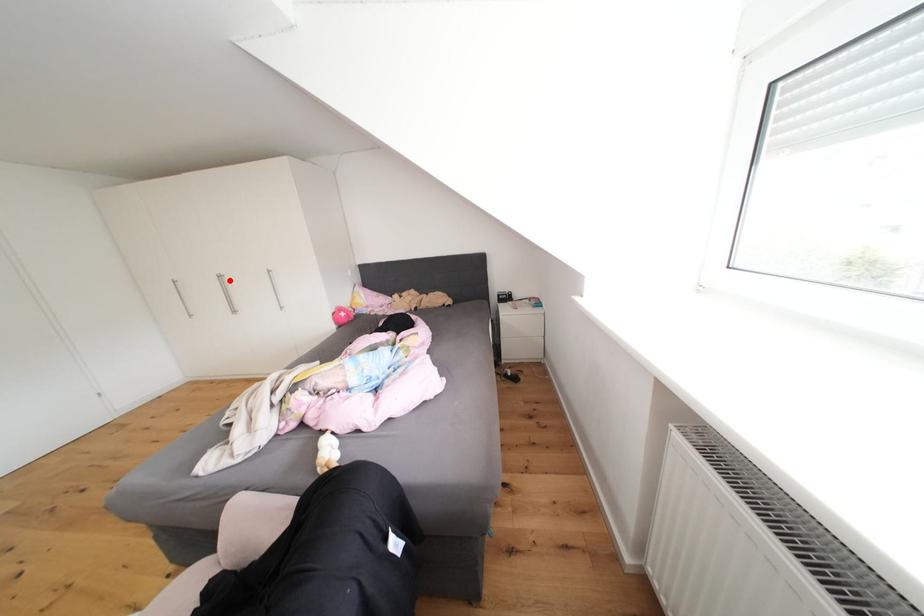
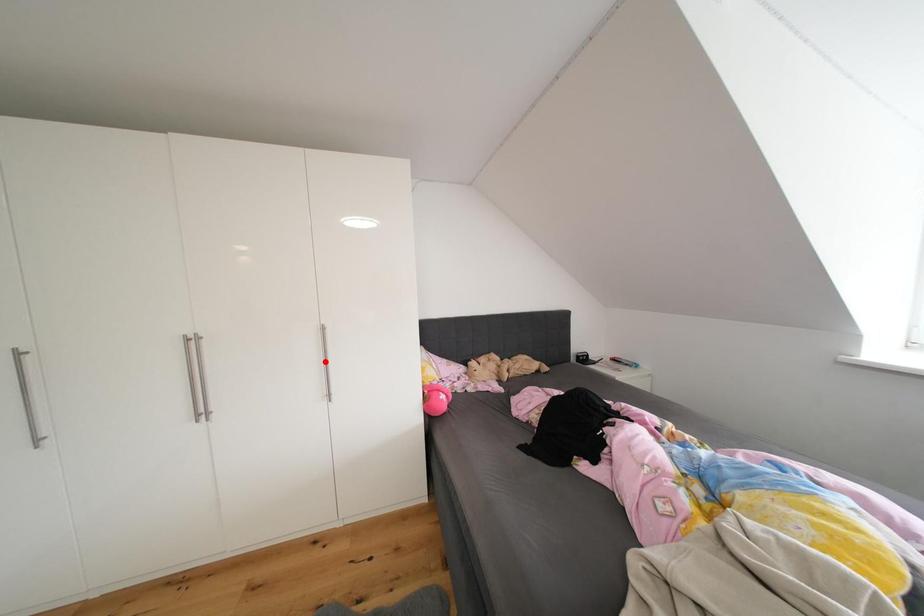
I am providing you with two images of the same scene from different viewpoints. A red point is marked on the first image and another point is marked on the second image. Do the highlighted points in image1 and image2 indicate the same real-world spot?

No